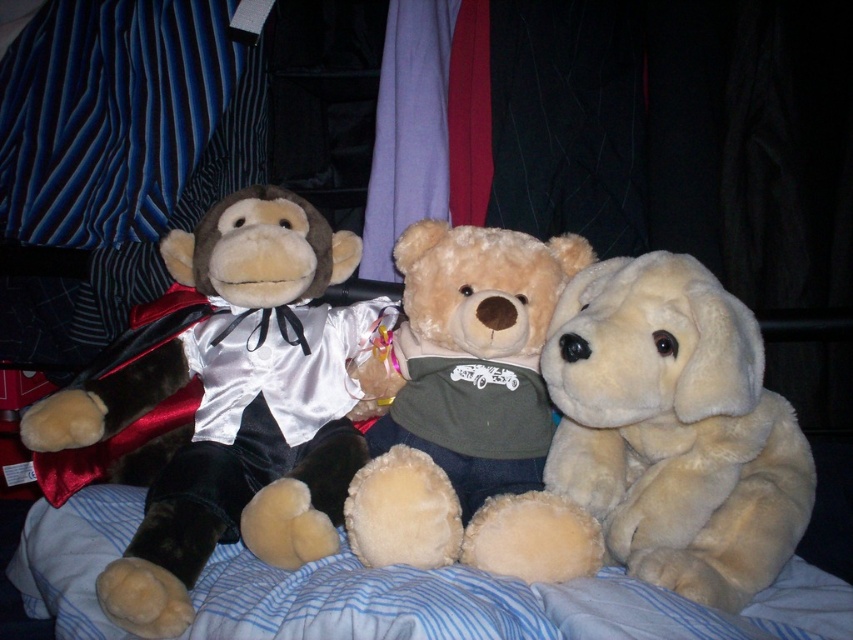
You are a child trying to reach the fluffy cream teddy bear at right and the soft plush teddy bear at center. Which one can you grab first without moving the other?

The fluffy cream teddy bear at right is in front of the soft plush teddy bear at center, so you can grab the fluffy cream teddy bear at right first without moving the other.

You are organizing a toy shelf and need to know which of the two plush toys is bigger to decide placement. Which is larger between the velvet monkey at left and the fluffy cream teddy bear at right?

The velvet monkey at left is larger than the fluffy cream teddy bear at right, so it should be placed accordingly on the shelf.